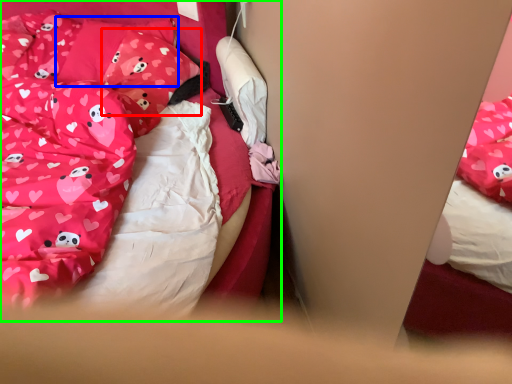
Question: Estimate the real-world distances between objects in this image. Which object is closer to pillow (highlighted by a red box), pillow (highlighted by a blue box) or bed (highlighted by a green box)?

Choices:
 (A) pillow
 (B) bed

Answer: (A)